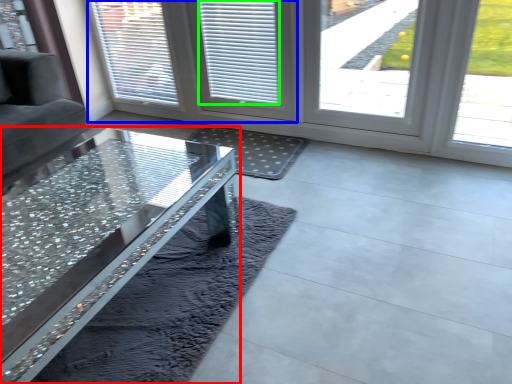
Question: Which object is positioned farthest from table (highlighted by a red box)? Select from screen door (highlighted by a blue box) and blind (highlighted by a green box).

Choices:
 (A) screen door
 (B) blind

Answer: (A)